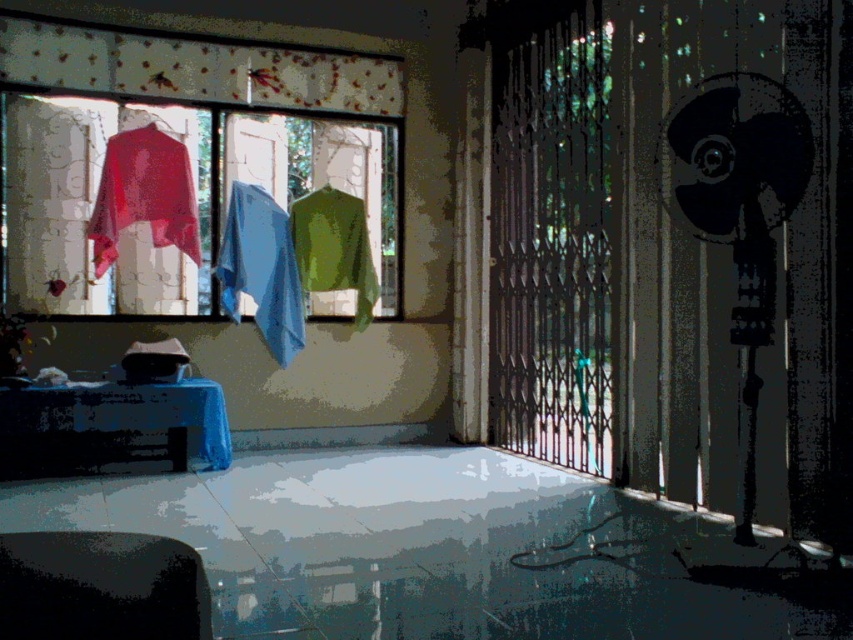
You are standing in the corridor and need to locate the point marked as coordinates point (195, 68). Where exactly is this point located?

The point (195, 68) is on the patterned fabric curtain at upper left.

You are a delivery person trying to locate the matte plastic window at center in the image. The coordinates given are point (195,196). Can you confirm if this point is within the boundaries of the matte plastic window at center?

Yes, the point (195,196) is within the boundaries of the matte plastic window at center as it corresponds to it.

You are a delivery person trying to enter the house through the open gate. You notice the patterned fabric curtain at upper left and the matte red sweater at left. Which object is higher up in the image?

The patterned fabric curtain at upper left is above the matte red sweater at left, so it is higher up in the image.